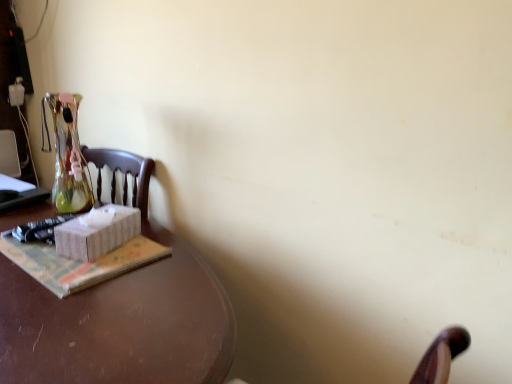
The image size is (512, 384). Find the location of `vacant area that is in front of white paper at left`. vacant area that is in front of white paper at left is located at coordinates (70, 312).